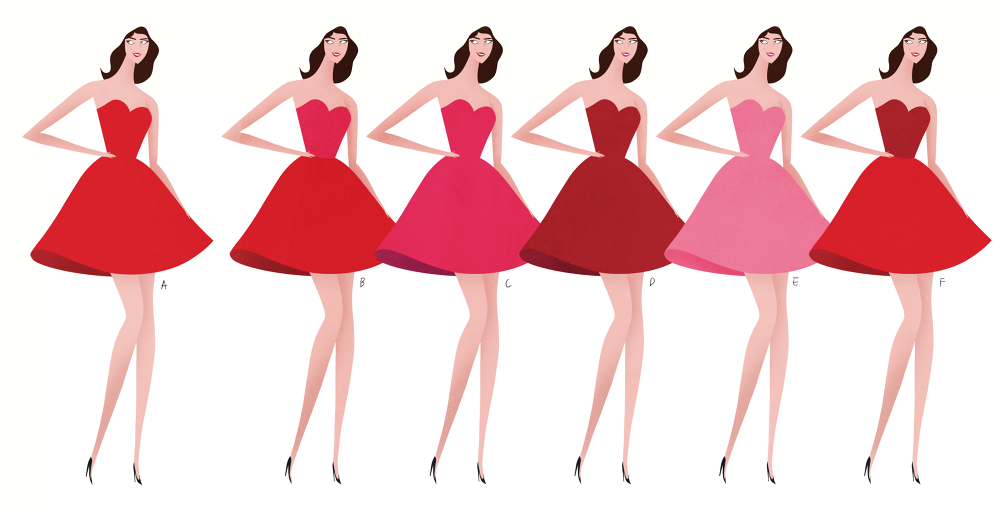
This screenshot has width=1000, height=512. I want to click on bust, so click(x=127, y=135), click(x=337, y=135), click(x=462, y=135), click(x=611, y=131), click(x=753, y=127), click(x=902, y=133).